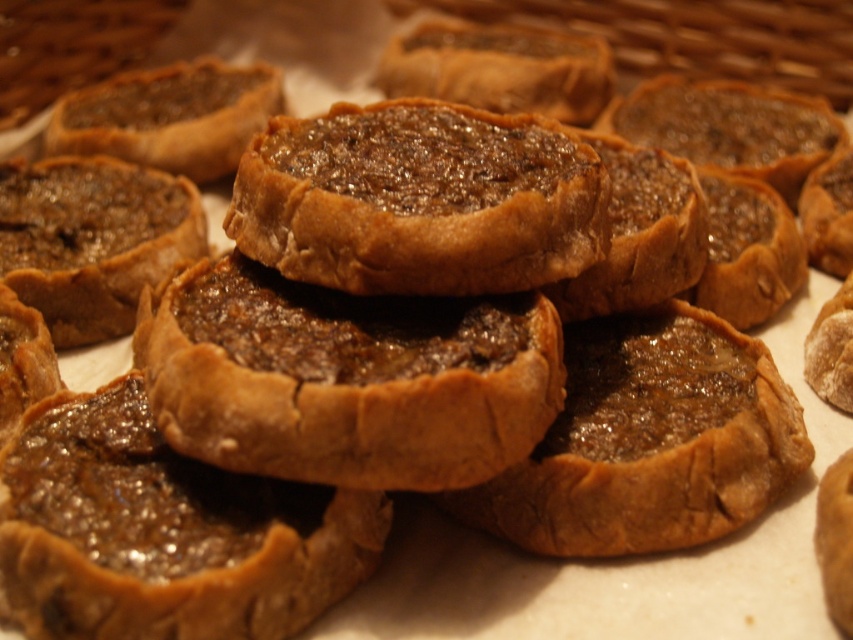
You are a pastry chef trying to place a new tartlet exactly at the center of the arrangement. The existing baked golden brown tartlet at center is represented by point (346, 378). Can you confirm if this point is the exact center of the arrangement?

The baked golden brown tartlet at center is represented by point (346, 378), so yes, this point is the exact center of the arrangement.

You are a baker who wants to stack these two pastries, shiny brown pastry at center and brown crumbly tart at center, on top of each other. Which pastry should be placed at the bottom to ensure stability?

The shiny brown pastry at center should be placed at the bottom because it is shorter than the brown crumbly tart at center, providing a stable base.

You are a delivery robot with a 36 inch wide tray. You need to place a pastry from the point at point [538,355] to another location. Can you fit the tray between them without moving the pastries?

The distance between the point at point [538,355] and the other pastry is 38.69 inches. Since the tray is 36 inches wide, it can fit between them as the distance is greater than the tray width.